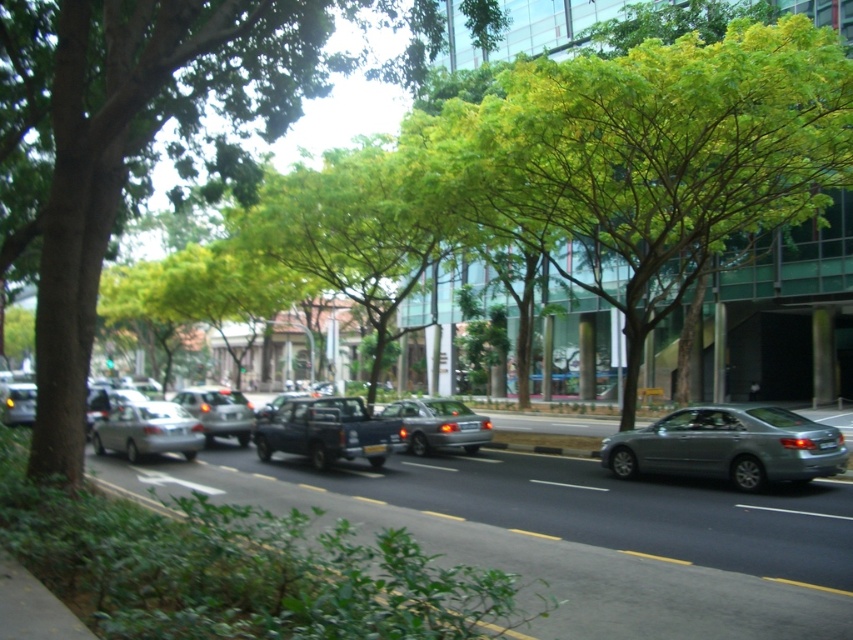
In the scene shown: You are a pedestrian standing on the sidewalk and want to cross the road to reach the other side. The green leafy tree at center and the matte silver sedan at center are in your line of sight. Which object is closer to you as you prepare to cross?

The green leafy tree at center is closer to the viewer than the matte silver sedan at center, so the tree is closer to you as you prepare to cross the road.

You are standing on the sidewalk in the image and want to reach a specific point marked at coordinates point (469, 445). Considering the vehicles parked along the road and the car driving away, is this point located on the sidewalk or the road?

The point (469, 445) is located on the road because it is 65.80 feet away from the viewer, which places it beyond the sidewalk area where the vehicles are parked and the car is driving.

Based on the photo, you are standing on the sidewalk in the image and want to walk to the point that is closer to you. Which point should you head towards, point [85,326] or point [463,436]?

You should head towards point [85,326] because it is closer to the viewer than point [463,436].